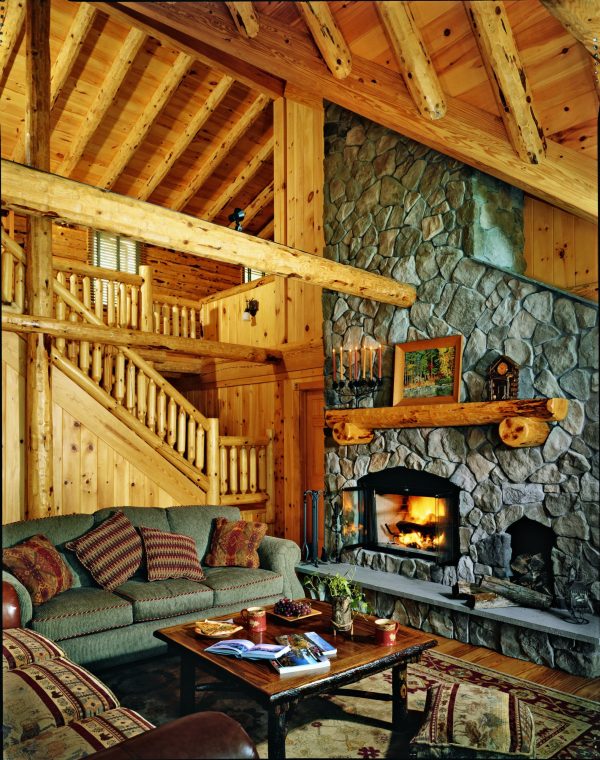
Locate an element on the screen. The height and width of the screenshot is (760, 600). square shaped dark brown hardwood coffee table is located at coordinates (360, 643).